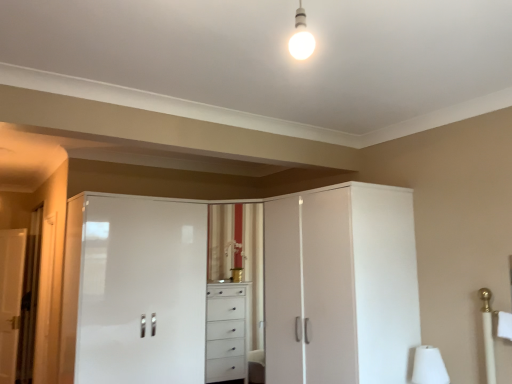
At what (x,y) coordinates should I click in order to perform the action: click on white glossy cabinet at center, acting as the second screen door starting from the right. Please return your answer as a coordinate pair (x, y). The height and width of the screenshot is (384, 512). Looking at the image, I should click on (142, 291).

The height and width of the screenshot is (384, 512). What do you see at coordinates (310, 289) in the screenshot? I see `white glossy cabinet at center, which is the first screen door from right to left` at bounding box center [310, 289].

Identify the location of white glossy door at left. (10, 298).

Which is behind, point (137, 334) or point (443, 383)?

The point (137, 334) is farther from the camera.

From a real-world perspective, which is physically above, white glossy cabinet at center, acting as the second screen door starting from the right, or white matte table lamp at lower right?

white glossy cabinet at center, acting as the second screen door starting from the right, is physically above.

From the image's perspective, is white glossy cabinet at center, acting as the second screen door starting from the right, beneath white matte table lamp at lower right?

Actually, white glossy cabinet at center, acting as the second screen door starting from the right, appears above white matte table lamp at lower right in the image.

From the image's perspective, count 1st screen doors upward from the white matte table lamp at lower right and point to it. Please provide its 2D coordinates.

[(142, 291)]

Would you consider white glossy cabinet at center, the second screen door positioned from the left, to be distant from white matte table lamp at lower right?

No, white glossy cabinet at center, the second screen door positioned from the left, is not far away from white matte table lamp at lower right.

Which object is further away from the camera taking this photo, white glossy cabinet at center, which is the first screen door from right to left, or white matte table lamp at lower right?

Positioned behind is white matte table lamp at lower right.

From the image's perspective, is white glossy cabinet at center, the second screen door positioned from the left, located beneath white matte table lamp at lower right?

Actually, white glossy cabinet at center, the second screen door positioned from the left, appears above white matte table lamp at lower right in the image.

Considering the sizes of objects white glossy cabinet at center, the second screen door positioned from the left, and white matte table lamp at lower right in the image provided, who is thinner, white glossy cabinet at center, the second screen door positioned from the left, or white matte table lamp at lower right?

white matte table lamp at lower right.

Which of these two, white glossy cabinet at center, the 1th screen door viewed from the left, or white glossy cabinet at center, the second screen door positioned from the left, stands shorter?

white glossy cabinet at center, the second screen door positioned from the left.

How far apart are white glossy cabinet at center, acting as the second screen door starting from the right, and white glossy cabinet at center, which is the first screen door from right to left?

3.29 feet.

Is white glossy cabinet at center, acting as the second screen door starting from the right, touching white glossy cabinet at center, which is the first screen door from right to left?

No, white glossy cabinet at center, acting as the second screen door starting from the right, is not in contact with white glossy cabinet at center, which is the first screen door from right to left.

Which of these two, white glossy door at left or white matte table lamp at lower right, is thinner?

With smaller width is white glossy door at left.

From the image's perspective, would you say white glossy door at left is positioned over white matte table lamp at lower right?

Incorrect, from the image's perspective, white glossy door at left is lower than white matte table lamp at lower right.

Considering the relative sizes of white glossy door at left and white matte table lamp at lower right in the image provided, is white glossy door at left smaller than white matte table lamp at lower right?

Incorrect, white glossy door at left is not smaller in size than white matte table lamp at lower right.

Which is farther from the camera, (0, 275) or (445, 380)?

Point (0, 275)

Consider the image. From a real-world perspective, who is located lower, white glossy door at left or white glossy cabinet at center, the second screen door positioned from the left?

white glossy door at left, from a real-world perspective.

Between point (24, 248) and point (297, 345), which one is positioned in front?

The point (297, 345) is more forward.

From the image's perspective, between white glossy door at left and white glossy cabinet at center, which is the first screen door from right to left, which one is located above?

From the image's view, white glossy cabinet at center, which is the first screen door from right to left, is above.

In the image, is white glossy door at left on the left side or the right side of white glossy cabinet at center, the second screen door positioned from the left?

From the image, it's evident that white glossy door at left is to the left of white glossy cabinet at center, the second screen door positioned from the left.

From the image's perspective, is white matte table lamp at lower right located above white glossy cabinet at center, the 1th screen door viewed from the left?

No, from the image's perspective, white matte table lamp at lower right is not over white glossy cabinet at center, the 1th screen door viewed from the left.

Considering the points (419, 371) and (134, 199), which point is in front, point (419, 371) or point (134, 199)?

The point (419, 371) is more forward.

Is white matte table lamp at lower right shorter than white glossy cabinet at center, the 1th screen door viewed from the left?

Correct, white matte table lamp at lower right is not as tall as white glossy cabinet at center, the 1th screen door viewed from the left.

How far apart are white glossy cabinet at center, which is the first screen door from right to left, and white glossy door at left?

white glossy cabinet at center, which is the first screen door from right to left, is 10.22 feet away from white glossy door at left.

Considering the sizes of objects white glossy cabinet at center, which is the first screen door from right to left, and white glossy door at left in the image provided, who is shorter, white glossy cabinet at center, which is the first screen door from right to left, or white glossy door at left?

white glossy cabinet at center, which is the first screen door from right to left.

Is the depth of white glossy cabinet at center, the second screen door positioned from the left, greater than that of white glossy door at left?

No.

Is white glossy cabinet at center, the second screen door positioned from the left, far from white glossy door at left?

Indeed, white glossy cabinet at center, the second screen door positioned from the left, is not near white glossy door at left.

Locate an element on the screen. This screenshot has width=512, height=384. the 1st screen door above the white matte table lamp at lower right (from a real-world perspective) is located at coordinates (142, 291).

Where is `table lamp below the white glossy cabinet at center, which is the first screen door from right to left (from the image's perspective)`? This screenshot has width=512, height=384. table lamp below the white glossy cabinet at center, which is the first screen door from right to left (from the image's perspective) is located at coordinates [x=429, y=366].

Estimate the real-world distances between objects in this image. Which object is further from white glossy door at left, white glossy cabinet at center, acting as the second screen door starting from the right, or white matte table lamp at lower right?

white matte table lamp at lower right is positioned further to the anchor white glossy door at left.

From the image, which object appears to be farther from white glossy cabinet at center, acting as the second screen door starting from the right, white glossy door at left or white glossy cabinet at center, the second screen door positioned from the left?

Based on the image, white glossy door at left appears to be further to white glossy cabinet at center, acting as the second screen door starting from the right.

Estimate the real-world distances between objects in this image. Which object is further from white matte table lamp at lower right, white glossy cabinet at center, the second screen door positioned from the left, or white glossy cabinet at center, acting as the second screen door starting from the right?

white glossy cabinet at center, acting as the second screen door starting from the right, is further to white matte table lamp at lower right.

From the picture: Looking at the image, which one is located further to white glossy cabinet at center, the 1th screen door viewed from the left, white matte table lamp at lower right or white glossy door at left?

white glossy door at left lies further to white glossy cabinet at center, the 1th screen door viewed from the left, than the other object.

Based on their spatial positions, is white glossy cabinet at center, the 1th screen door viewed from the left, or white glossy cabinet at center, which is the first screen door from right to left, further from white matte table lamp at lower right?

white glossy cabinet at center, the 1th screen door viewed from the left, is positioned further to the anchor white matte table lamp at lower right.

When comparing their distances from white matte table lamp at lower right, does white glossy cabinet at center, which is the first screen door from right to left, or white glossy door at left seem closer?

white glossy cabinet at center, which is the first screen door from right to left, is positioned closer to the anchor white matte table lamp at lower right.

Considering their positions, is white glossy cabinet at center, which is the first screen door from right to left, positioned further to white glossy cabinet at center, acting as the second screen door starting from the right, than white matte table lamp at lower right?

white matte table lamp at lower right lies further to white glossy cabinet at center, acting as the second screen door starting from the right, than the other object.

When comparing their distances from white glossy cabinet at center, acting as the second screen door starting from the right, does white glossy cabinet at center, which is the first screen door from right to left, or white glossy door at left seem closer?

The object closer to white glossy cabinet at center, acting as the second screen door starting from the right, is white glossy cabinet at center, which is the first screen door from right to left.

What are the coordinates of `screen door between white glossy cabinet at center, the 1th screen door viewed from the left, and white matte table lamp at lower right, in the horizontal direction` in the screenshot? It's located at (310, 289).

Find the location of a particular element. screen door located between white glossy door at left and white glossy cabinet at center, which is the first screen door from right to left, in the left-right direction is located at coordinates (142, 291).